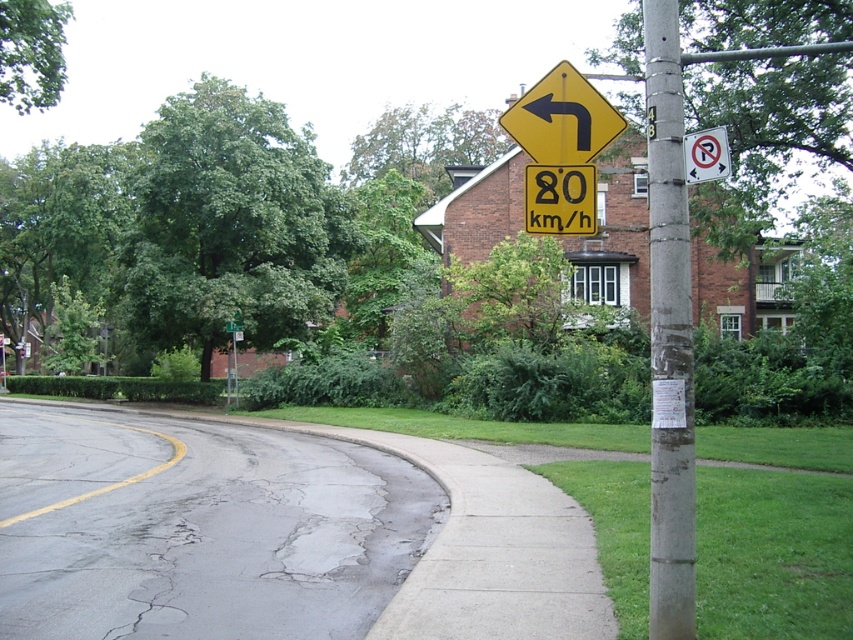
You are a delivery driver who needs to park your van on the suburban street. The van is 2 meters wide. Can you park between the concrete pole at right and the green plastic street sign at upper center without overlapping either object?

The concrete pole at right occupies less space than the green plastic street sign at upper center, so there might not be enough space to park the van between them. Check the distance between the two objects to ensure the van fits without overlapping.

You are driving a car and see the concrete pole at right and the white plastic no parking sign at upper right. Which object is smaller in size?

The concrete pole at right is smaller in size compared to the white plastic no parking sign at upper right.